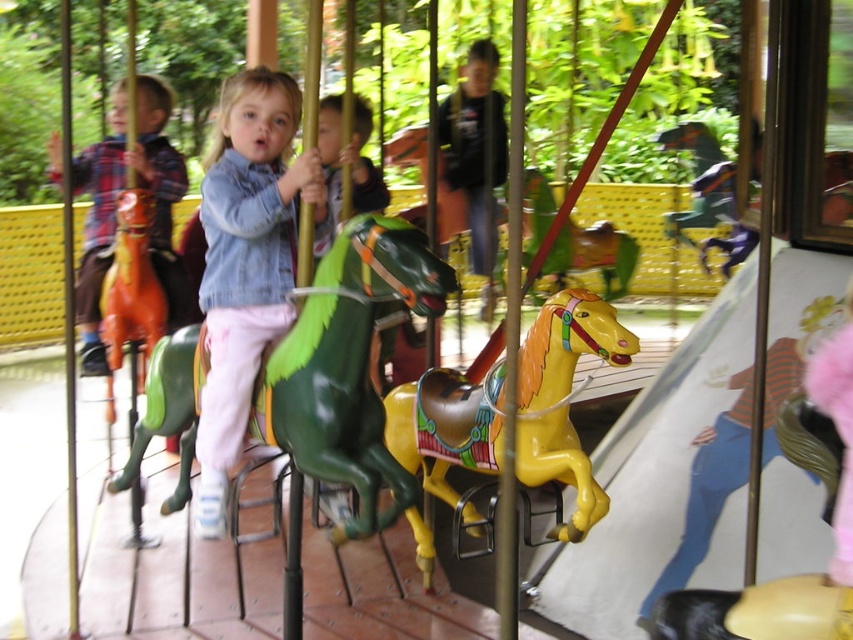
You are standing at the entrance of the carousel and want to locate the green glossy horse at center. According to its 2D coordinates, where should you look relative to the carousel?

The green glossy horse at center is located at the coordinates point (350, 368), which means it is positioned slightly to the right and above the center of the carousel.

You are a parent at the amusement park and want to take a photo of your child on the green glossy horse at center and the person wearing the matte plaid shirt at left. Can you stand in a position where both are visible in the same frame?

The green glossy horse at center is below the matte plaid shirt at left, so if you position yourself at a slight angle above the horse, you should be able to capture both in the same frame.

You are a parent trying to choose between two carousel horses for your child. The green glossy horse at center and the shiny yellow horse at center are both available. Based on their sizes, which horse would you recommend for a smaller child?

The green glossy horse at center has a lesser width compared to the shiny yellow horse at center, so it would be more suitable for a smaller child due to its narrower size.